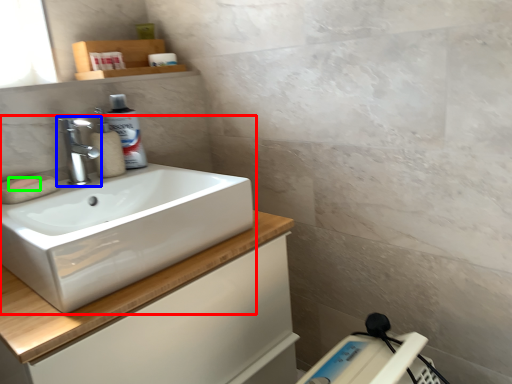
Question: Considering the real-world distances, which object is closest to sink (highlighted by a red box)? tap (highlighted by a blue box) or soap (highlighted by a green box).

Choices:
 (A) tap
 (B) soap

Answer: (A)